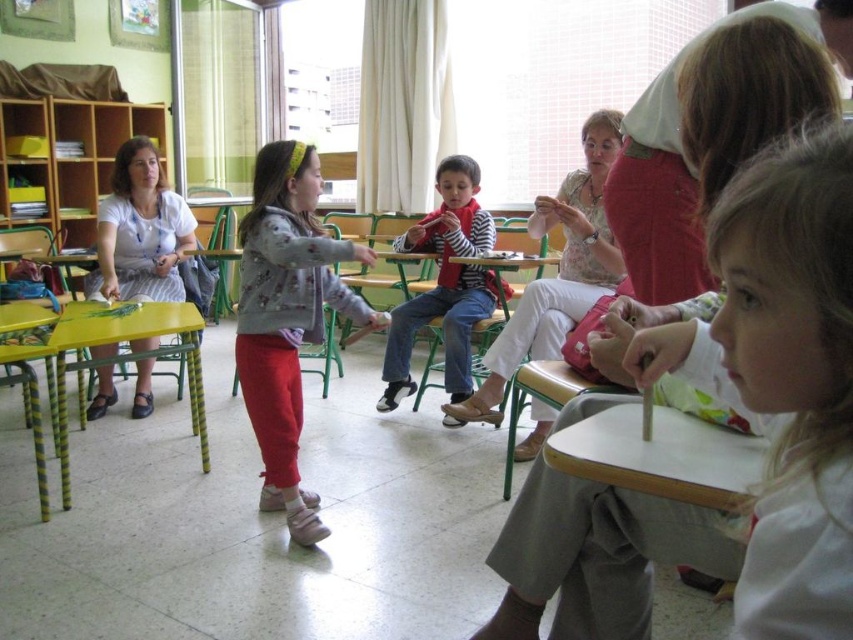
You are a student sitting at the desk in the classroom. You notice a point at coordinates (287,316). What object in the scene is located at that point?

The fluffy gray sweater at center is located at point (287,316).

You are a photographer trying to capture a closeup of the two points in the classroom image. Which point, point (264,276) or point (467,232), is closer to your camera lens?

Point (264,276) is closer to the camera lens than point (467,232).

In the classroom scene, there are two children wearing a fluffy gray sweater at center and a striped cotton shirt at center. Which child is sitting lower in the image?

The fluffy gray sweater at center is positioned under the striped cotton shirt at center, so the child wearing the fluffy gray sweater at center is sitting lower in the image.